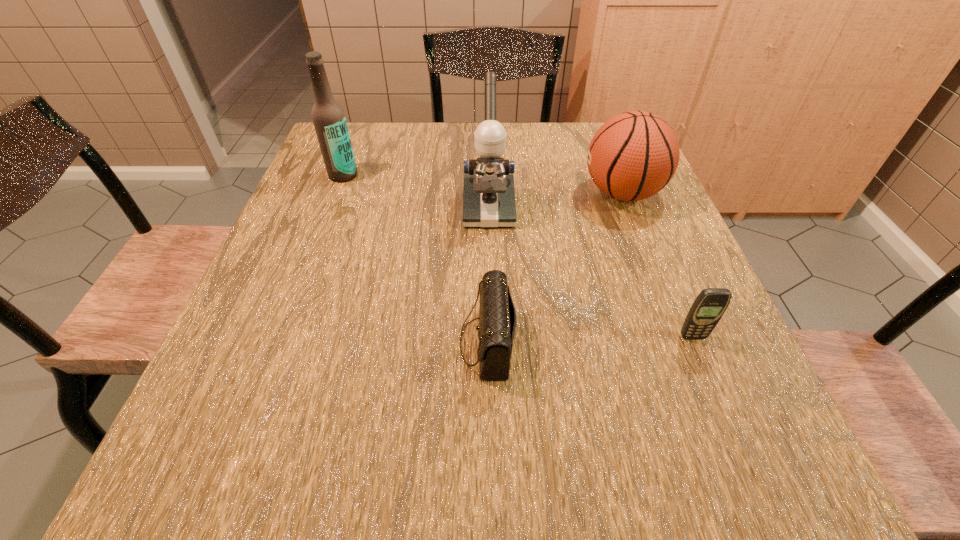
You are a GUI agent. You are given a task and a screenshot of the screen. Output one action in this format:
    pyautogui.click(x=<x>, y=<y>)
    Task: Click on the beer bottle
    
    Given the screenshot: What is the action you would take?
    click(x=329, y=120)

In order to click on microscope in this screenshot , I will do pyautogui.click(x=488, y=193).

Image resolution: width=960 pixels, height=540 pixels. Find the location of `the third tallest object`. the third tallest object is located at coordinates (x=634, y=155).

This screenshot has width=960, height=540. I want to click on the second shortest object, so click(x=709, y=306).

The width and height of the screenshot is (960, 540). What are the coordinates of `clutch bag` in the screenshot? It's located at (497, 317).

This screenshot has height=540, width=960. Identify the location of free spot located 0.220m on the label of the leftmost object. (318, 242).

The image size is (960, 540). Identify the location of free point located 0.070m at the eyepiece of the microscope. (490, 251).

In order to click on free spot located 0.080m on the side where the inflation valve is located in this screenshot , I will do `click(548, 193)`.

The width and height of the screenshot is (960, 540). What are the coordinates of `free space located on the side where the inflation valve is located` in the screenshot? It's located at (544, 193).

Image resolution: width=960 pixels, height=540 pixels. Identify the location of vacant space located on the side where the inflation valve is located. (557, 193).